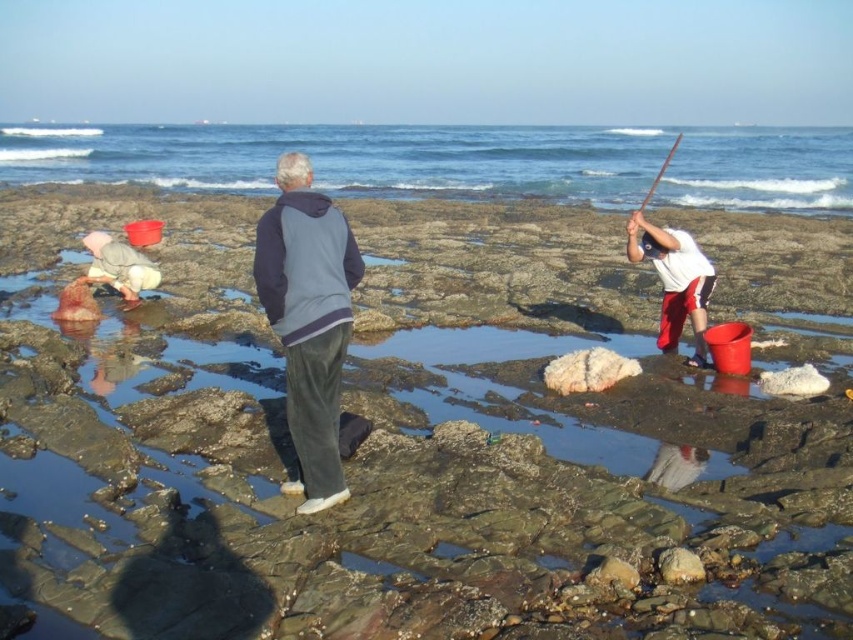
You are planning to take a photo of the gray fleece jacket at center and the white cotton shirt at right. Which one should you zoom in more on to ensure both are clearly visible in the frame?

Since the gray fleece jacket at center is smaller than the white cotton shirt at right, you should zoom in more on the gray fleece jacket at center to ensure both are clearly visible in the frame.

You are standing at the point labeled point (x=308, y=321) in the image. What object are you currently on?

The point labeled point (x=308, y=321) is located on the gray fleece jacket at center.

You are standing on the rocky shoreline and want to know which object takes up more space in the image. Based on the scene, which is larger in size between the blue ocean water at upper center and the white cotton shirt at right?

The blue ocean water at upper center is bigger than the white cotton shirt at right, so the blue ocean water at upper center takes up more space in the image.